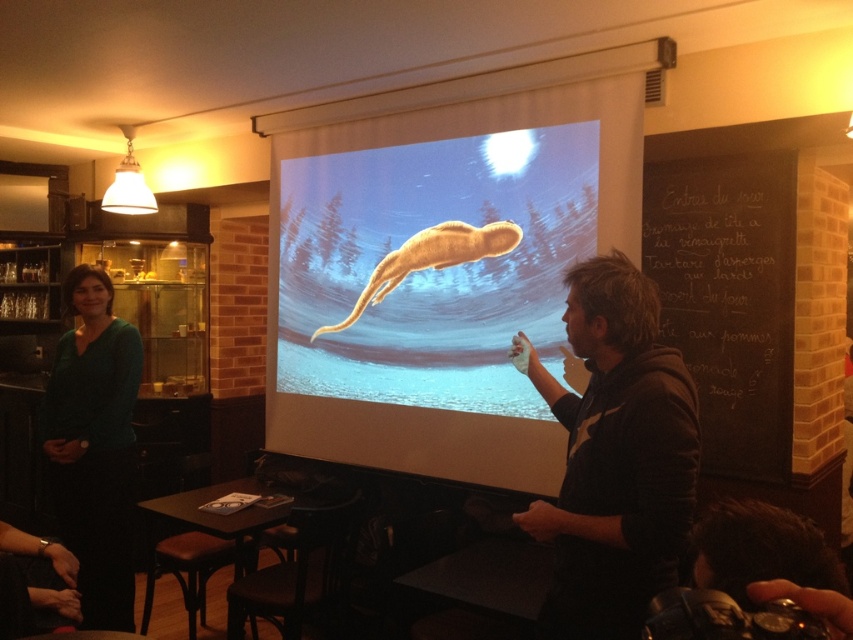
Is dark brown hoodie at center wider than green matte dress at left?

In fact, dark brown hoodie at center might be narrower than green matte dress at left.

Is dark brown hoodie at center below green matte dress at left?

No.

What do you see at coordinates (614, 458) in the screenshot? This screenshot has height=640, width=853. I see `dark brown hoodie at center` at bounding box center [614, 458].

Locate an element on the screen. dark brown hoodie at center is located at coordinates (614, 458).

Describe the element at coordinates (729, 300) in the screenshot. The height and width of the screenshot is (640, 853). I see `black chalkboard at upper right` at that location.

Find the location of a particular element. The width and height of the screenshot is (853, 640). black chalkboard at upper right is located at coordinates pyautogui.click(x=729, y=300).

Where is `black chalkboard at upper right`? The width and height of the screenshot is (853, 640). black chalkboard at upper right is located at coordinates (729, 300).

Find the location of `black chalkboard at upper right`. black chalkboard at upper right is located at coordinates (729, 300).

Which is more to the left, dark brown hoodie at center or black chalkboard at upper right?

dark brown hoodie at center

Which is above, dark brown hoodie at center or black chalkboard at upper right?

black chalkboard at upper right is above.

Does point (595, 276) come in front of point (718, 435)?

Yes, point (595, 276) is closer to viewer.

Locate an element on the screen. The height and width of the screenshot is (640, 853). dark brown hoodie at center is located at coordinates (614, 458).